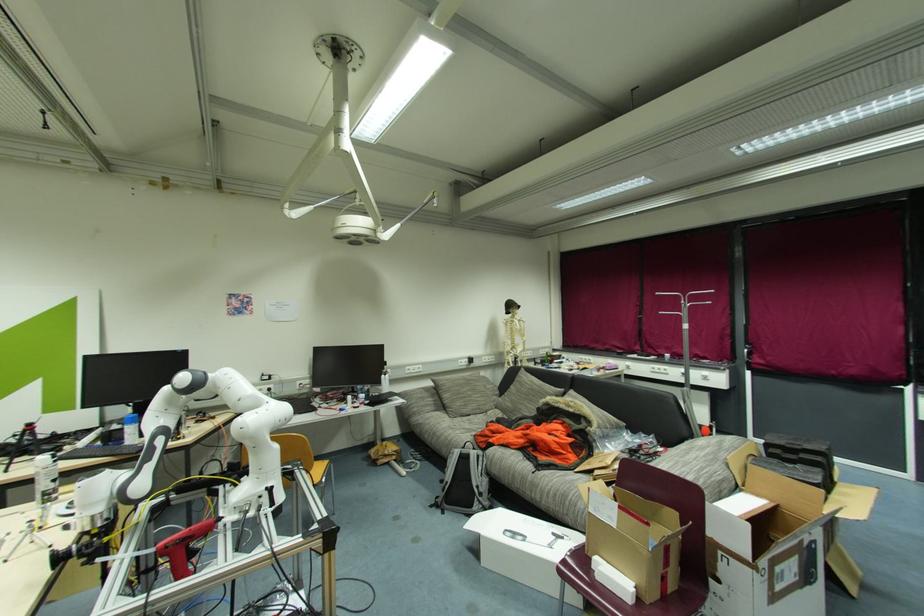
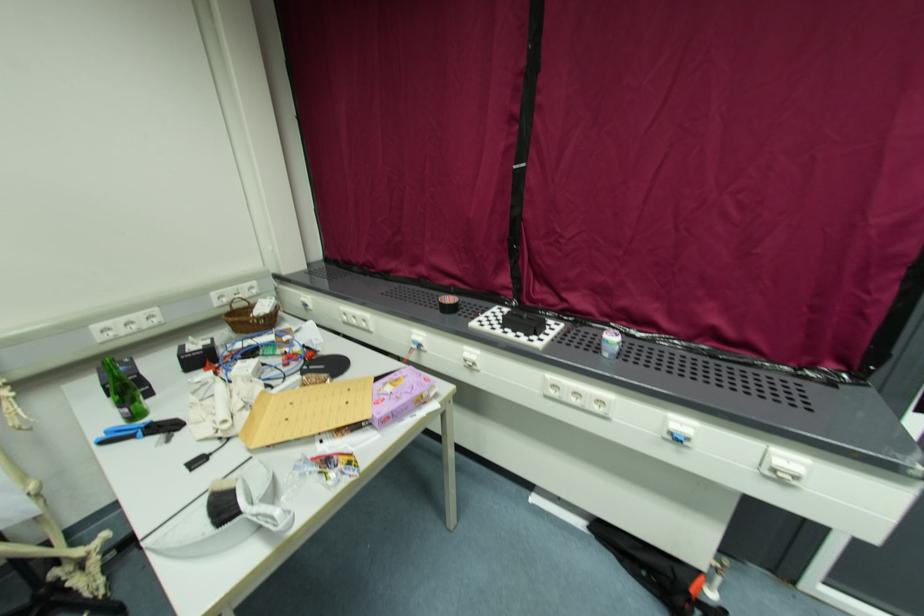
Where in the second image is the point corresponding to pixel 709 379 from the first image?

(783, 477)